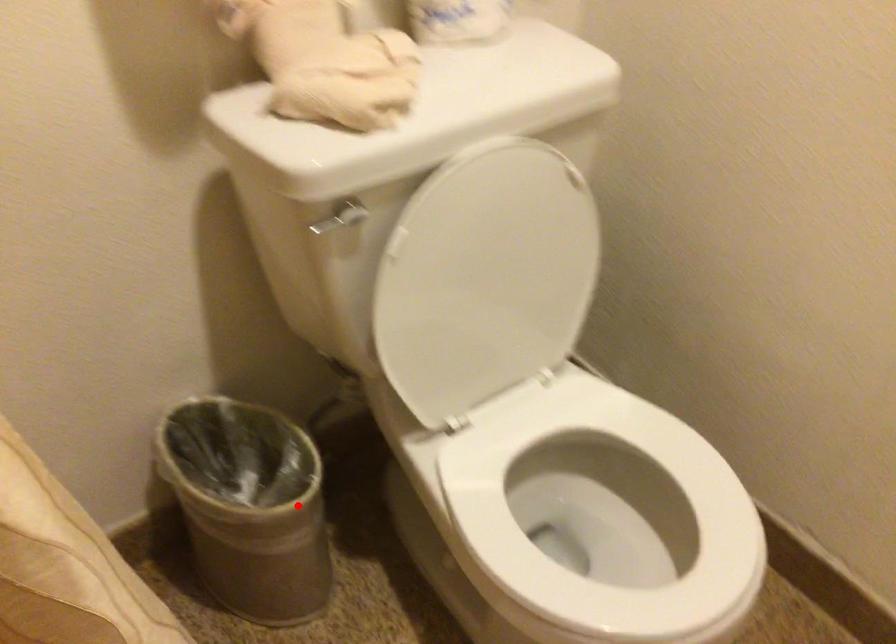
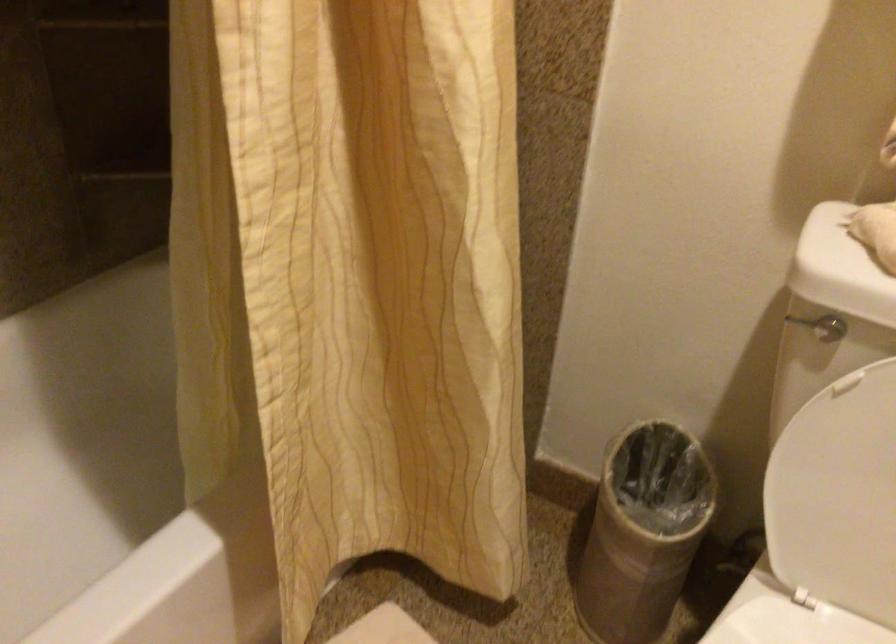
Find the pixel in the second image that matches the highlighted location in the first image.

(643, 532)